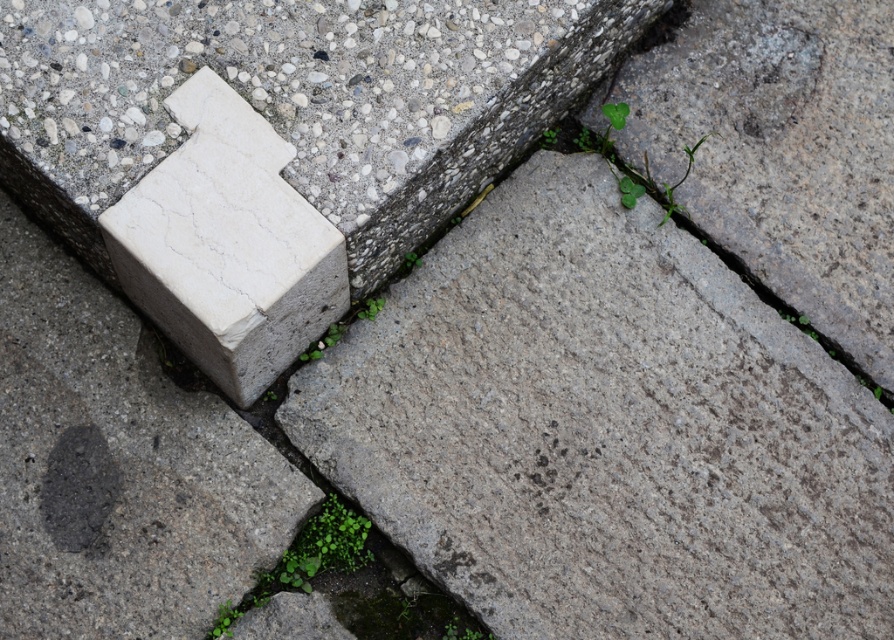
From the picture: You are standing on the stone pathway and notice two green leafy weeds. One is the green leafy weed at lower center and the other is the green leafy weed at center. Which weed is positioned to the left when facing the pathway?

The green leafy weed at lower center is to the left of the green leafy weed at center.

You are a gardener who needs to determine which object is higher between the white marble block at upper left and the green leafy weed at lower center. Based on the scene, which one is taller?

The white marble block at upper left is taller than the green leafy weed at lower center according to the description.